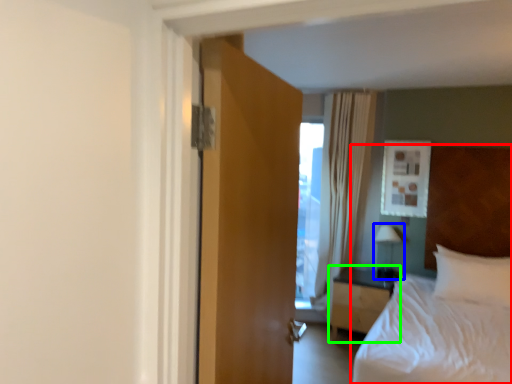
Question: Considering the real-world distances, which object is farthest from bed (highlighted by a red box)? lamp (highlighted by a blue box) or nightstand (highlighted by a green box)?

Choices:
 (A) lamp
 (B) nightstand

Answer: (A)